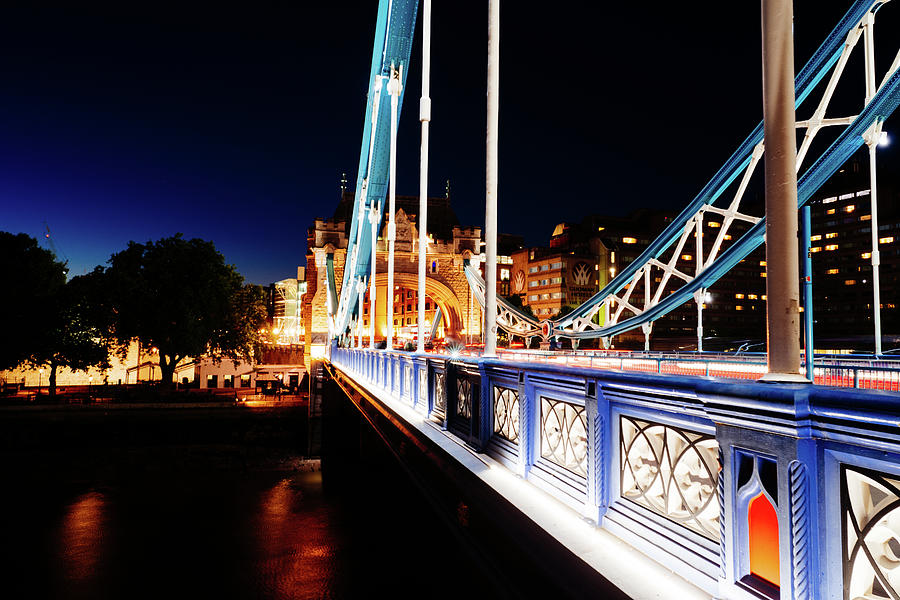
Image resolution: width=900 pixels, height=600 pixels. Identify the location of cables. (168, 372), (789, 249).